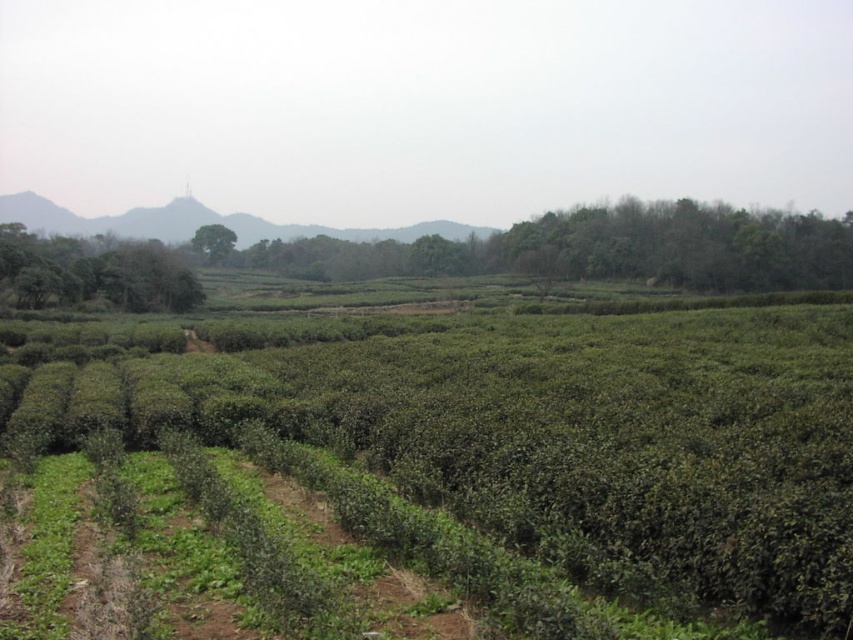
Question: Does green leafy tree at left have a lesser width compared to green leafy tree at center?

Choices:
 (A) yes
 (B) no

Answer: (B)

Question: Which object appears closest to the camera in this image?

Choices:
 (A) green leafy tree at center
 (B) green leafy tree at left

Answer: (B)

Question: Is green leafy tree at left smaller than green leafy tree at center?

Choices:
 (A) yes
 (B) no

Answer: (B)

Question: Does green leafy tree at left appear over green leafy tree at center?

Choices:
 (A) no
 (B) yes

Answer: (A)

Question: Which point appears closest to the camera in this image?

Choices:
 (A) (196, 244)
 (B) (55, 280)

Answer: (B)

Question: Which point is farther from the camera taking this photo?

Choices:
 (A) (169, 266)
 (B) (196, 230)

Answer: (B)